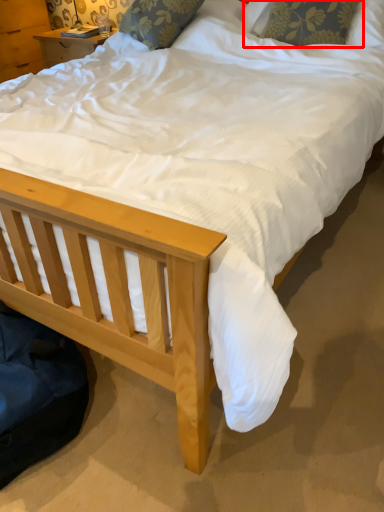
Question: Considering the relative positions of pillow (annotated by the red box) and pillow in the image provided, where is pillow (annotated by the red box) located with respect to the staircase?

Choices:
 (A) left
 (B) right

Answer: (B)